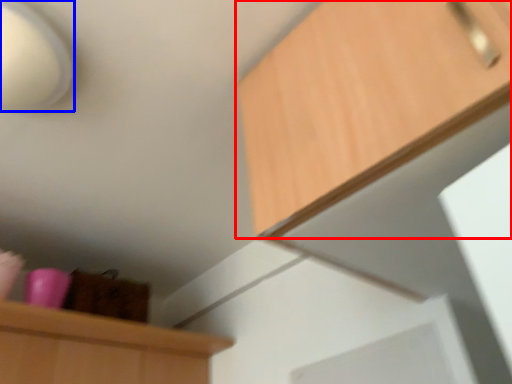
Question: Which object appears farthest to the camera in this image, cabinetry (highlighted by a red box) or lamp (highlighted by a blue box)?

Choices:
 (A) cabinetry
 (B) lamp

Answer: (B)